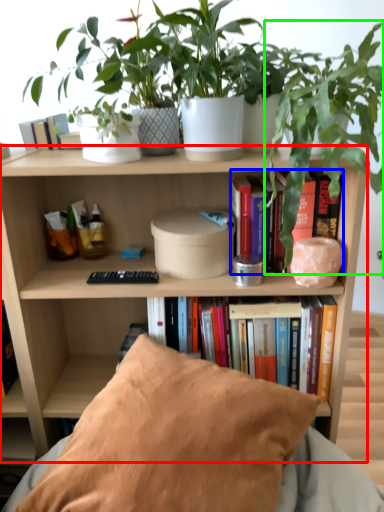
Question: Estimate the real-world distances between objects in this image. Which object is farther from bookcase (highlighted by a red box), book (highlighted by a blue box) or houseplant (highlighted by a green box)?

Choices:
 (A) book
 (B) houseplant

Answer: (A)